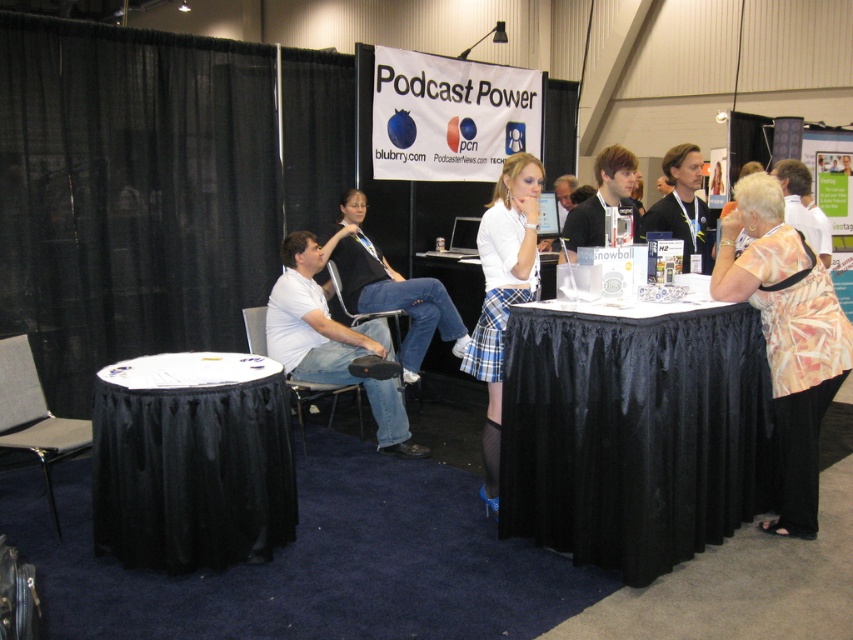
You are a guest speaker at the event and need to move from your current position near the gray fabric chair at lower left to the black fabric chair at center to give a speech. Can you walk directly between them without needing to move any obstacles?

The gray fabric chair at lower left and black fabric chair at center are 6.44 feet apart from each other, so yes, you can walk directly between them without needing to move any obstacles since the distance is sufficient for a person to walk through comfortably.